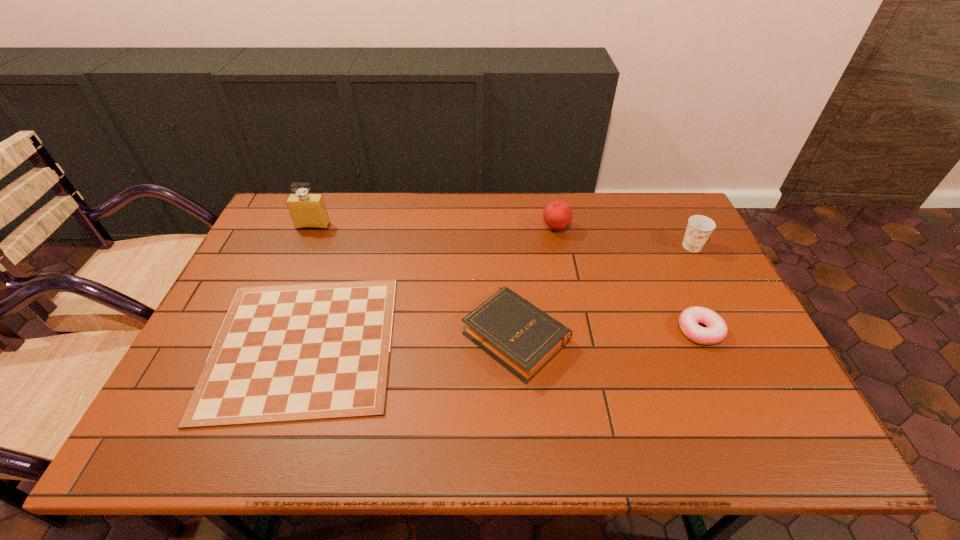
Locate an element on the screen. This screenshot has width=960, height=540. vacant area that lies between the doughnut and the Dixie cup is located at coordinates (696, 288).

Where is `empty space that is in between the apple and the perfume`? empty space that is in between the apple and the perfume is located at coordinates (434, 227).

I want to click on unoccupied area between the perfume and the apple, so click(x=434, y=227).

The height and width of the screenshot is (540, 960). In order to click on free space between the checkerboard and the fourth tallest object in this screenshot , I will do [x=409, y=340].

The image size is (960, 540). Find the location of `vacant region between the Dixie cup and the apple`. vacant region between the Dixie cup and the apple is located at coordinates (624, 237).

Locate an element on the screen. object that ranks as the third closest to the doughnut is located at coordinates (557, 214).

Locate an element on the screen. This screenshot has height=540, width=960. object that stands as the third closest to the shortest object is located at coordinates (557, 214).

The width and height of the screenshot is (960, 540). In order to click on blank space that satisfies the following two spatial constraints: 1. on the front-facing side of the apple; 2. on the left side of the perfume in this screenshot , I will do [x=312, y=228].

You are a GUI agent. You are given a task and a screenshot of the screen. Output one action in this format:
    pyautogui.click(x=<x>, y=<y>)
    Task: Click on the vacant area that satisfies the following two spatial constraints: 1. on the front-facing side of the Dixie cup; 2. on the right side of the perfume
    The width and height of the screenshot is (960, 540).
    Given the screenshot: What is the action you would take?
    pyautogui.click(x=304, y=246)

The width and height of the screenshot is (960, 540). In order to click on vacant region that satisfies the following two spatial constraints: 1. on the front-facing side of the perfume; 2. on the right side of the fourth tallest object in this screenshot , I will do `click(267, 335)`.